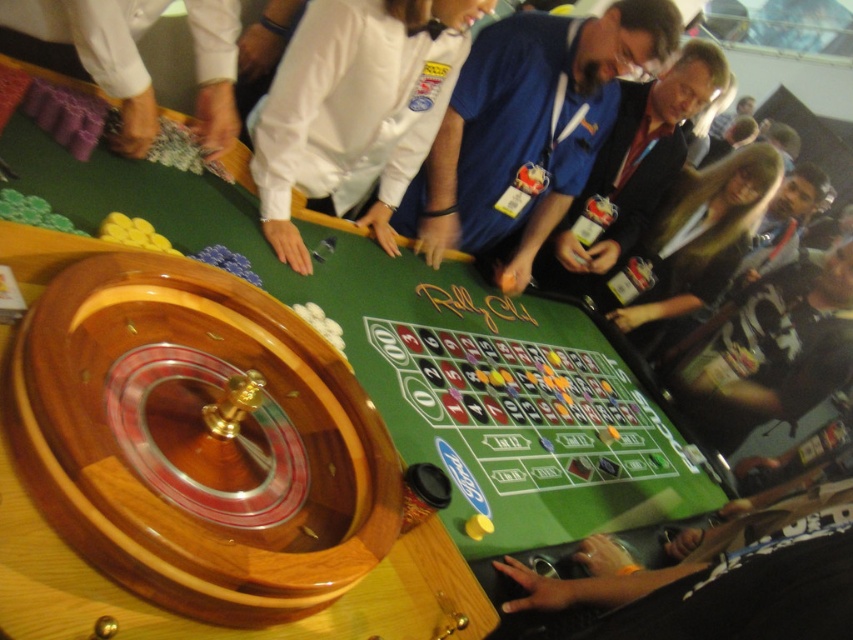
You are standing at the roulette table and want to place a bet. There are two points marked on the table, point (358, 80) and point (677, 300). Which point is closer to you?

Point (358, 80) is closer to the viewer than point (677, 300).

You are a photographer positioned behind the roulette table. You want to capture a photo of the white shirt at center and the long brown hair at center without any overlap between them. Based on their widths, which subject should be placed closer to the camera to ensure they don t overlap?

The white shirt at center has a smaller width than the long brown hair at center. To prevent overlap, position the white shirt at center closer to the camera since its narrower width requires less space in the frame compared to the wider long brown hair at center.